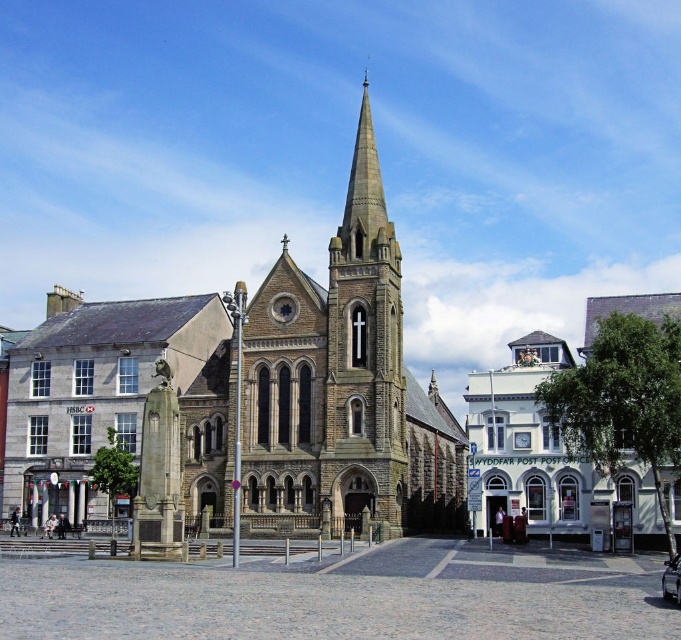
Does point (244, 516) lie in front of point (328, 394)?

No, it is behind (328, 394).

Does brown stone church at center have a larger size compared to dark gray stone tower at center?

Indeed, brown stone church at center has a larger size compared to dark gray stone tower at center.

What do you see at coordinates (343, 387) in the screenshot? I see `brown stone church at center` at bounding box center [343, 387].

Identify the location of brown stone church at center. (343, 387).